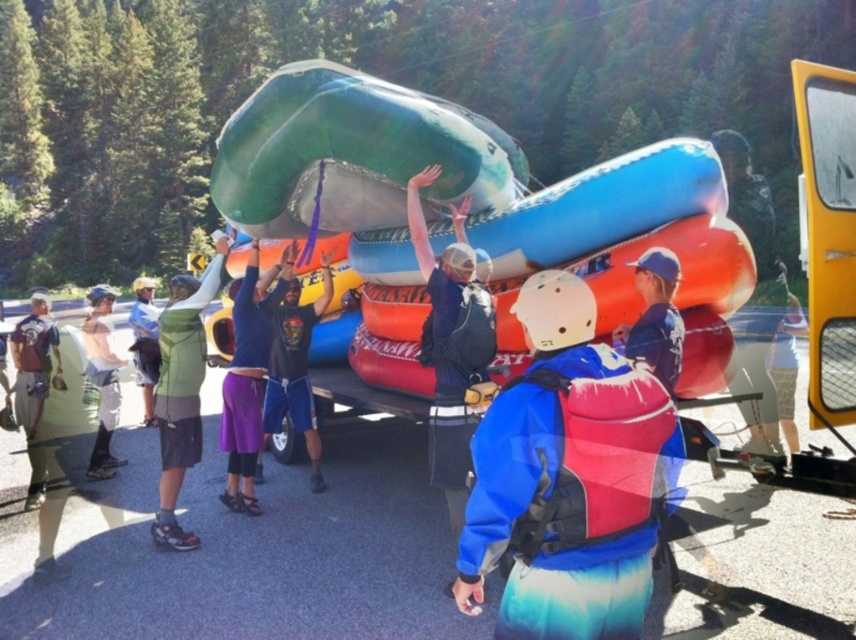
Question: Can you confirm if dark blue t-shirt at center is thinner than matte green jacket at left?

Choices:
 (A) yes
 (B) no

Answer: (A)

Question: Which of the following is the closest to the observer?

Choices:
 (A) green matte shirt at center
 (B) green matte raft at center
 (C) purple fabric pants at lower right
 (D) blue rubber raft at center

Answer: (C)

Question: Which object is positioned farthest from the green matte jacket at center?

Choices:
 (A) green matte raft at center
 (B) dark blue t-shirt at center
 (C) blue matte life jacket at center
 (D) blue rubber raft at center

Answer: (A)

Question: Observing the image, what is the correct spatial positioning of blue rubber raft at center in reference to green matte jacket at center?

Choices:
 (A) above
 (B) below

Answer: (A)

Question: Among these objects, which one is nearest to the camera?

Choices:
 (A) green matte shirt at center
 (B) purple fabric pants at lower right

Answer: (B)

Question: Considering the relative positions of blue rubber raft at center and purple fabric pants at lower right in the image provided, where is blue rubber raft at center located with respect to purple fabric pants at lower right?

Choices:
 (A) below
 (B) above

Answer: (B)